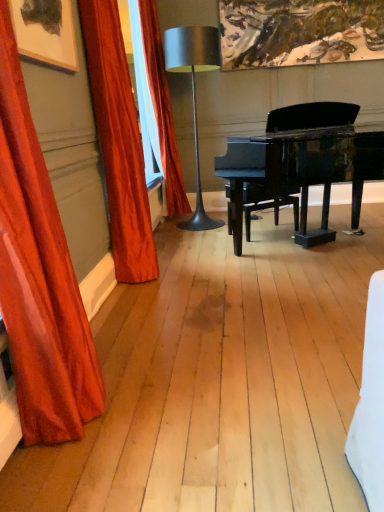
The height and width of the screenshot is (512, 384). In order to click on vacant space behind satin red curtain at left, acting as the 1th curtain starting from the front in this screenshot , I will do `click(133, 340)`.